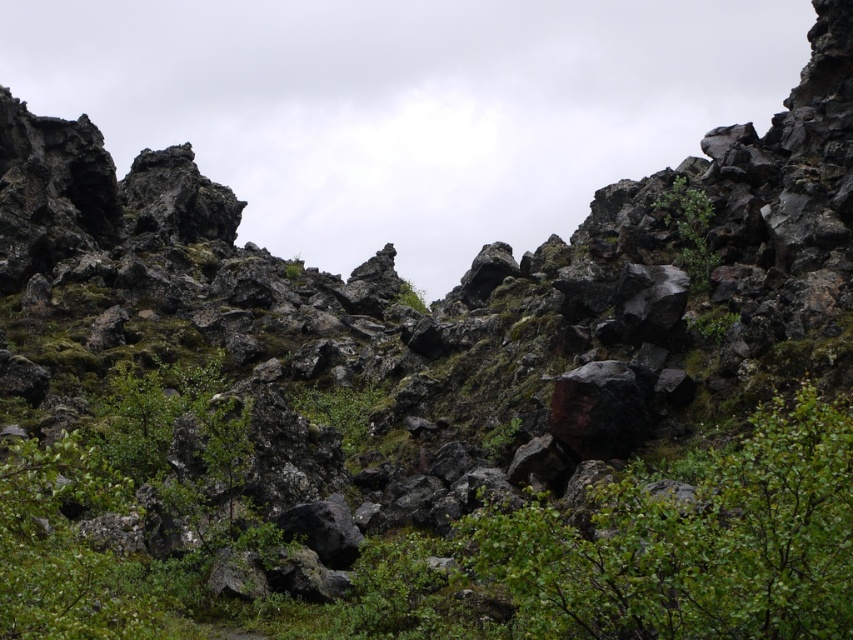
You are a hiker trying to navigate through the rocky terrain. You notice two green leafy shrubs in the scene. Which shrub, the green leafy shrubs at center or the green leafy shrub at upper right, is taller?

The green leafy shrubs at center is taller than the green leafy shrub at upper right.